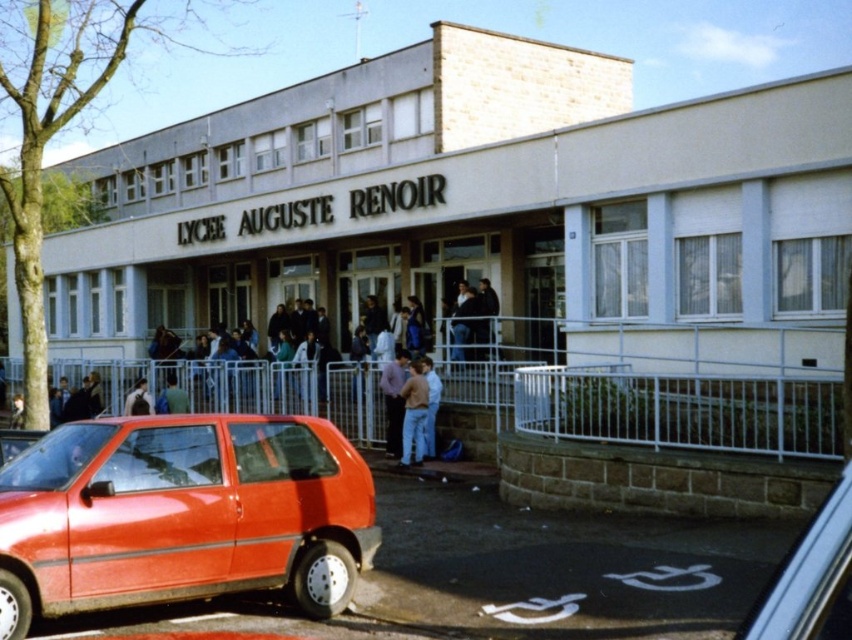
Which of these two, shiny red hatchback at lower left or metallic red car at lower right, stands taller?

Standing taller between the two is shiny red hatchback at lower left.

Does shiny red hatchback at lower left come behind metallic red car at lower right?

Yes, shiny red hatchback at lower left is further from the viewer.

Which is in front, point (75, 556) or point (806, 589)?

Point (806, 589) is in front.

This screenshot has height=640, width=852. Find the location of `shiny red hatchback at lower left`. shiny red hatchback at lower left is located at coordinates (182, 515).

Can you confirm if shiny red hatchback at lower left is taller than light blue jeans at center?

Incorrect, shiny red hatchback at lower left's height is not larger of light blue jeans at center's.

Is shiny red hatchback at lower left positioned in front of light blue jeans at center?

Yes, shiny red hatchback at lower left is in front of light blue jeans at center.

What do you see at coordinates (182, 515) in the screenshot?
I see `shiny red hatchback at lower left` at bounding box center [182, 515].

The height and width of the screenshot is (640, 852). I want to click on shiny red hatchback at lower left, so 182,515.

Is metallic red car at lower right to the left of light blue jeans at center from the viewer's perspective?

No, metallic red car at lower right is not to the left of light blue jeans at center.

Image resolution: width=852 pixels, height=640 pixels. Identify the location of metallic red car at lower right. (810, 579).